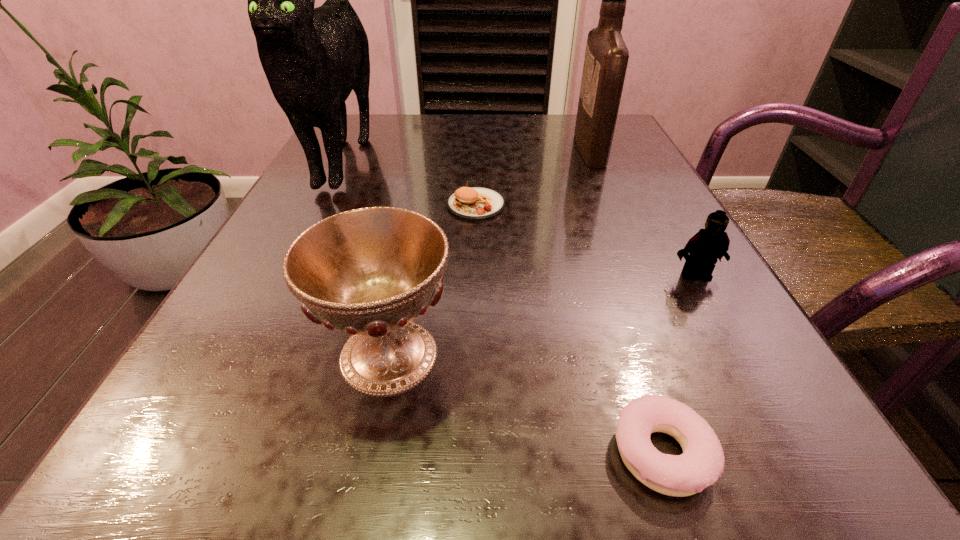
In the image, there is a desktop. At what (x,y) coordinates should I click in order to perform the action: click on vacant space at the right edge. Please return your answer as a coordinate pair (x, y). The width and height of the screenshot is (960, 540). Looking at the image, I should click on (667, 382).

Identify the location of free space at the far left corner of the desktop. Image resolution: width=960 pixels, height=540 pixels. (371, 114).

Image resolution: width=960 pixels, height=540 pixels. What are the coordinates of `free region at the near left corner` in the screenshot? It's located at (170, 509).

Image resolution: width=960 pixels, height=540 pixels. I want to click on blank area at the far right corner, so click(x=571, y=125).

What are the coordinates of `free space between the fourth shortest object and the liquor` in the screenshot? It's located at (490, 252).

Identify the location of free area in between the shortest object and the fourth tallest object. The width and height of the screenshot is (960, 540). (679, 363).

Where is `vacant space that is in between the shortest object and the second shortest object`? The image size is (960, 540). vacant space that is in between the shortest object and the second shortest object is located at coordinates [568, 328].

Identify the location of free space that is in between the tallest object and the liquor. The height and width of the screenshot is (540, 960). (468, 152).

The image size is (960, 540). I want to click on free space between the tallest object and the patty, so click(x=411, y=180).

Where is `empty space that is in between the third tallest object and the liquor`? empty space that is in between the third tallest object and the liquor is located at coordinates (490, 252).